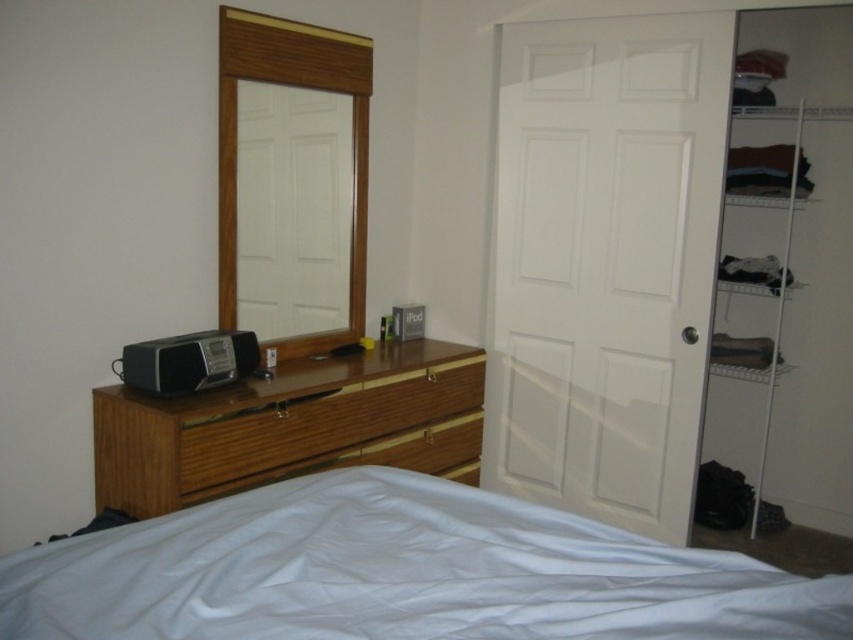
Who is lower down, wooden frame at upper center or satin black radio at center?

satin black radio at center is below.

Is point (300, 342) closer to viewer compared to point (206, 376)?

No, it is not.

What do you see at coordinates (236, 141) in the screenshot? This screenshot has width=853, height=640. I see `wooden frame at upper center` at bounding box center [236, 141].

Where is `wooden frame at upper center`? This screenshot has width=853, height=640. wooden frame at upper center is located at coordinates (236, 141).

Does white smooth bedcover at lower center come behind satin black radio at center?

Result: That is False.

Does white smooth bedcover at lower center have a lesser width compared to satin black radio at center?

Incorrect, white smooth bedcover at lower center's width is not less than satin black radio at center's.

Where is `white smooth bedcover at lower center`? white smooth bedcover at lower center is located at coordinates 399,573.

Between point (724, 593) and point (228, 10), which one is positioned behind?

Point (228, 10)

Does white smooth bedcover at lower center have a greater width compared to wooden frame at upper center?

Yes.

Locate an element on the screen. The image size is (853, 640). white smooth bedcover at lower center is located at coordinates (399, 573).